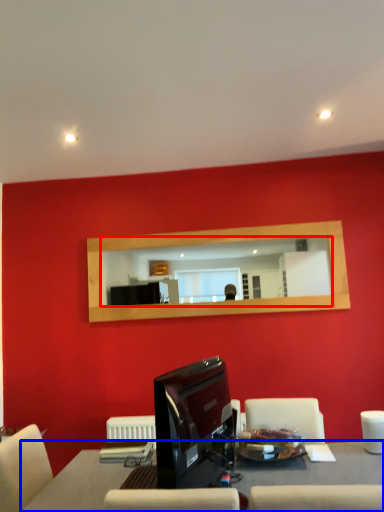
Question: Among these objects, which one is farthest to the camera, mirror (highlighted by a red box) or table (highlighted by a blue box)?

Choices:
 (A) mirror
 (B) table

Answer: (A)